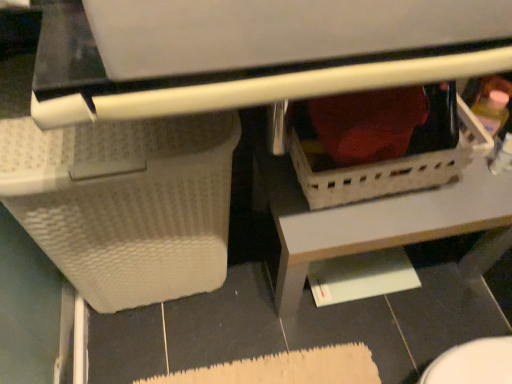
Find the location of a particular element. The width and height of the screenshot is (512, 384). free spot in front of white plastic basket at lower center is located at coordinates (359, 338).